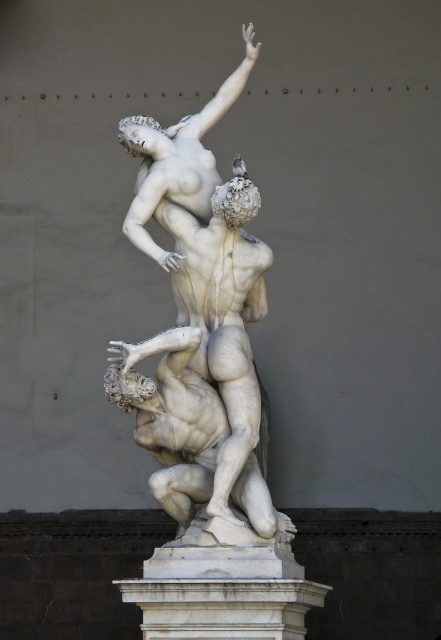
You are standing in a museum and see the white marble sculpture at center. The museum has a strict no touching policy, and you want to admire the sculpture without violating the rules. Considering the distance between you and the sculpture, can you get a clear view of its intricate details from where you are standing?

The white marble sculpture at center is 242.73 feet away from the viewer, which is too far to see intricate details clearly without specialized equipment. Therefore, you cannot get a clear view of its details from your current position.